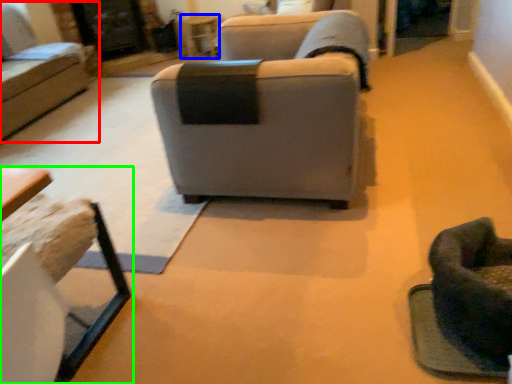
Question: Which object is the farthest from studio couch (highlighted by a red box)? Choose among these: table (highlighted by a blue box) or table (highlighted by a green box).

Choices:
 (A) table
 (B) table

Answer: (B)